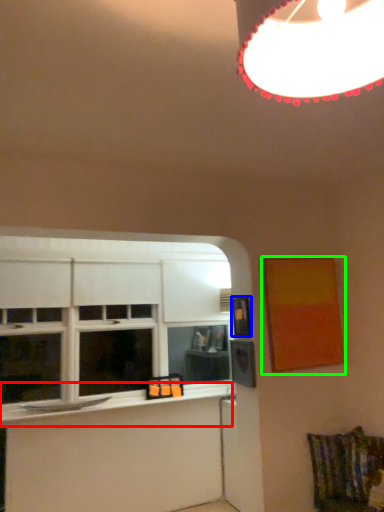
Question: Which object is the closest to the window sill (highlighted by a red box)? Choose among these: picture frame (highlighted by a blue box) or picture frame (highlighted by a green box).

Choices:
 (A) picture frame
 (B) picture frame

Answer: (A)